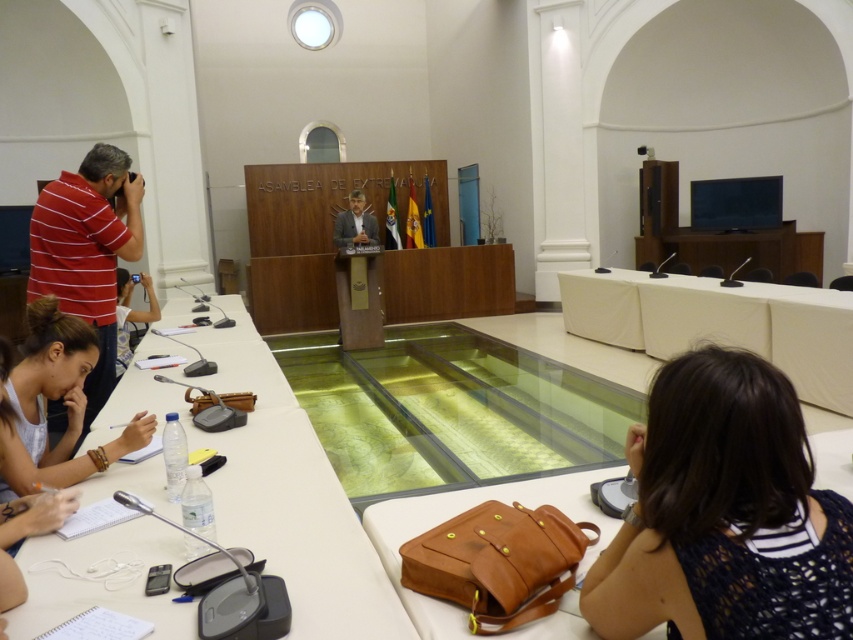
What do you see at coordinates (86, 250) in the screenshot?
I see `striped cotton shirt at left` at bounding box center [86, 250].

Is striped cotton shirt at left positioned before white leather notebook at lower left?

No, striped cotton shirt at left is further to the viewer.

The width and height of the screenshot is (853, 640). I want to click on striped cotton shirt at left, so click(86, 250).

How far apart are dark blue knitted sweater at lower right and light brown leather jacket at center?

dark blue knitted sweater at lower right and light brown leather jacket at center are 19.13 feet apart.

Is dark blue knitted sweater at lower right closer to camera compared to light brown leather jacket at center?

Yes, it is.

Image resolution: width=853 pixels, height=640 pixels. What do you see at coordinates (724, 515) in the screenshot? I see `dark blue knitted sweater at lower right` at bounding box center [724, 515].

Find the location of a particular element. This screenshot has height=640, width=853. dark blue knitted sweater at lower right is located at coordinates (724, 515).

Which is in front, point (83, 413) or point (370, 218)?

Point (83, 413) is in front.

Is white leather notebook at lower left above light brown leather jacket at center?

Actually, white leather notebook at lower left is below light brown leather jacket at center.

I want to click on white leather notebook at lower left, so click(x=61, y=403).